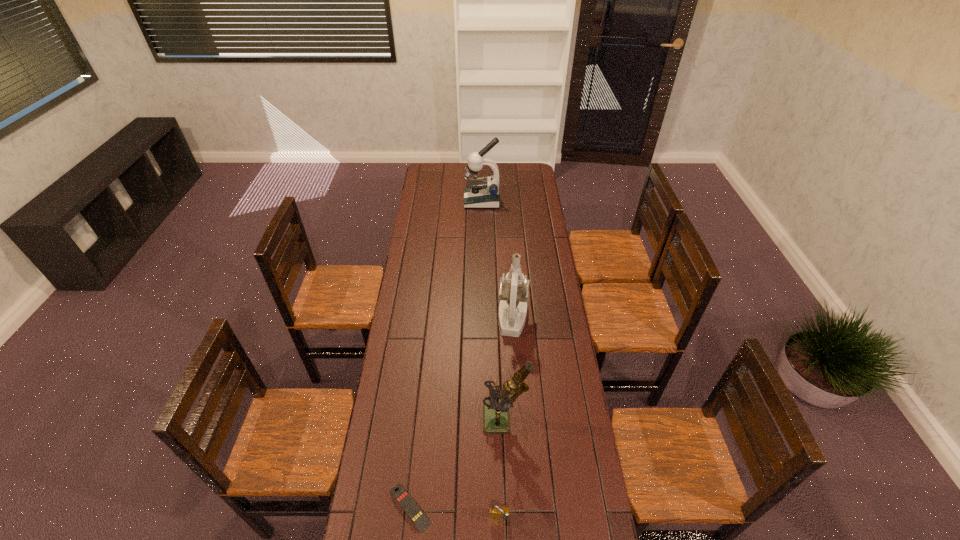
Where is `the farthest object`? The image size is (960, 540). the farthest object is located at coordinates (483, 192).

Find the location of `the second farthest object`. the second farthest object is located at coordinates (514, 288).

Identify the location of the nearest microscope. (496, 407).

Locate an element on the screen. the fourth tallest object is located at coordinates (496, 512).

I want to click on the shortest object, so click(x=410, y=507).

You are a GUI agent. You are given a task and a screenshot of the screen. Output one action in this format:
    pyautogui.click(x=<x>, y=<y>)
    Task: Click on the leftmost object
    The image size is (960, 540).
    Given the screenshot: What is the action you would take?
    pyautogui.click(x=410, y=507)

What are the coordinates of `vacant space situated 0.200m at the eyepiece of the farthest microscope` in the screenshot? It's located at (430, 201).

At what (x,y) coordinates should I click in order to perform the action: click on free space located at the eyepiece of the farthest microscope. Please return your answer as a coordinate pair (x, y). Looking at the image, I should click on (435, 201).

Where is `free space located at the eyepiece of the farthest microscope`? free space located at the eyepiece of the farthest microscope is located at coordinates (445, 201).

The image size is (960, 540). I want to click on free space located on the left of the second farthest microscope, so click(466, 318).